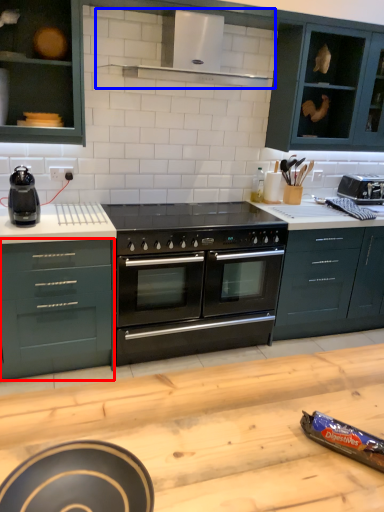
Question: Which object appears closest to the camera in this image, drawer (highlighted by a red box) or exhaust hood (highlighted by a blue box)?

Choices:
 (A) drawer
 (B) exhaust hood

Answer: (B)